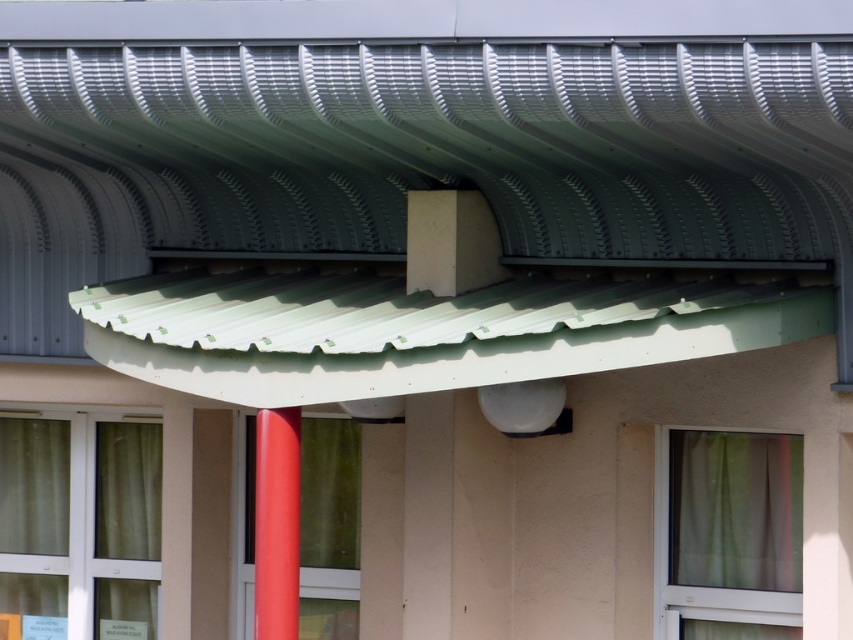
Is green sheer curtain at lower right smaller than glossy red pole at center?

No.

Can you confirm if green sheer curtain at lower right is taller than glossy red pole at center?

Yes.

Locate an element on the screen. The height and width of the screenshot is (640, 853). green sheer curtain at lower right is located at coordinates (735, 509).

How much distance is there between green fabric curtain at lower left and glossy red pole at center?

The distance of green fabric curtain at lower left from glossy red pole at center is 12.65 feet.

Does point (61, 477) come behind point (280, 460)?

Yes, point (61, 477) is farther from viewer.

Where is `green fabric curtain at lower left`? green fabric curtain at lower left is located at coordinates (79, 525).

This screenshot has width=853, height=640. What do you see at coordinates (79, 525) in the screenshot?
I see `green fabric curtain at lower left` at bounding box center [79, 525].

Between point (103, 464) and point (755, 577), which one is positioned in front?

Point (755, 577) is more forward.

Locate an element on the screen. The width and height of the screenshot is (853, 640). green fabric curtain at lower left is located at coordinates (79, 525).